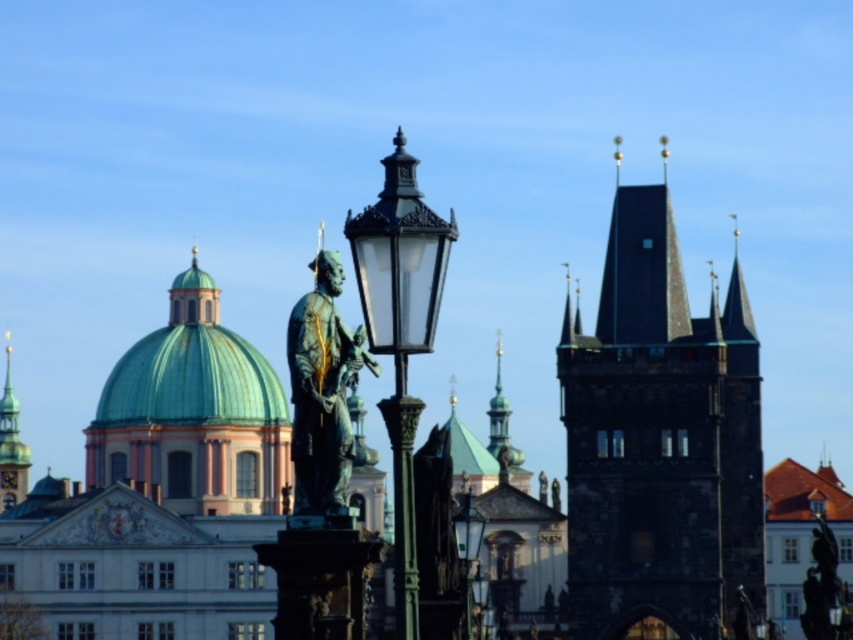
Is gold textured spire at upper left above matte black street light at center?

Incorrect, gold textured spire at upper left is not positioned above matte black street light at center.

This screenshot has width=853, height=640. Describe the element at coordinates (10, 444) in the screenshot. I see `gold textured spire at upper left` at that location.

Locate an element on the screen. gold textured spire at upper left is located at coordinates (10, 444).

Where is `gold textured spire at upper left`? gold textured spire at upper left is located at coordinates (10, 444).

Is bronze statue at center wider than matte black street light at center?

Indeed, bronze statue at center has a greater width compared to matte black street light at center.

Is bronze statue at center taller than matte black street light at center?

Yes, bronze statue at center is taller than matte black street light at center.

The width and height of the screenshot is (853, 640). I want to click on bronze statue at center, so click(x=825, y=589).

Does green patinated bronze statue at center have a lesser height compared to bronze statue at center?

In fact, green patinated bronze statue at center may be taller than bronze statue at center.

Between point (310, 444) and point (843, 596), which one is positioned behind?

The point (843, 596) is behind.

Find the location of a particular element. Image resolution: width=853 pixels, height=640 pixels. green patinated bronze statue at center is located at coordinates (323, 394).